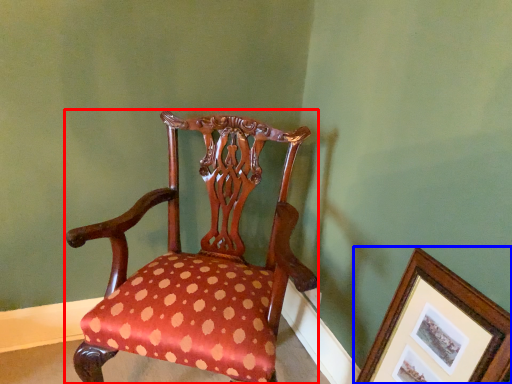
Question: Which point is closer to the camera, chair (highlighted by a red box) or picture frame (highlighted by a blue box)?

Choices:
 (A) chair
 (B) picture frame

Answer: (B)